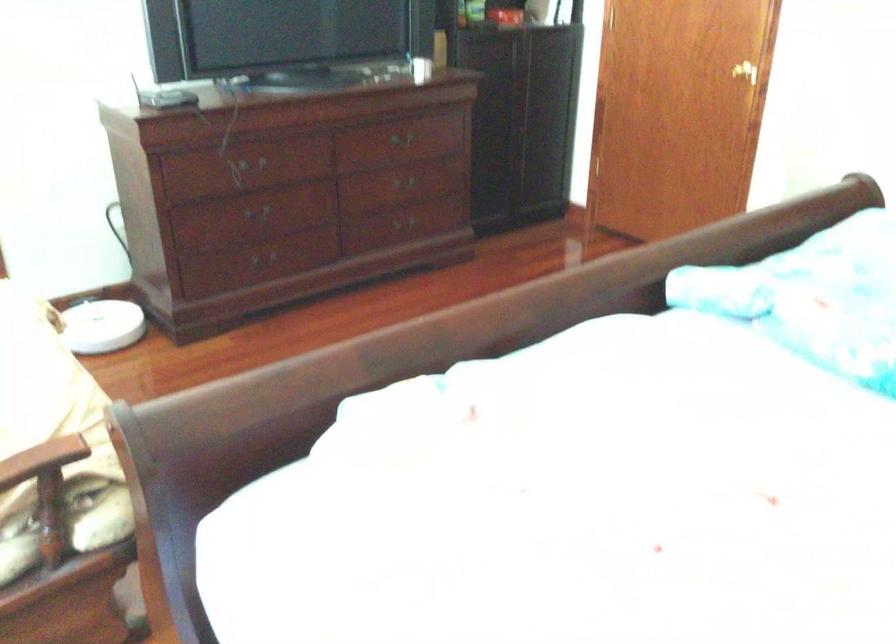
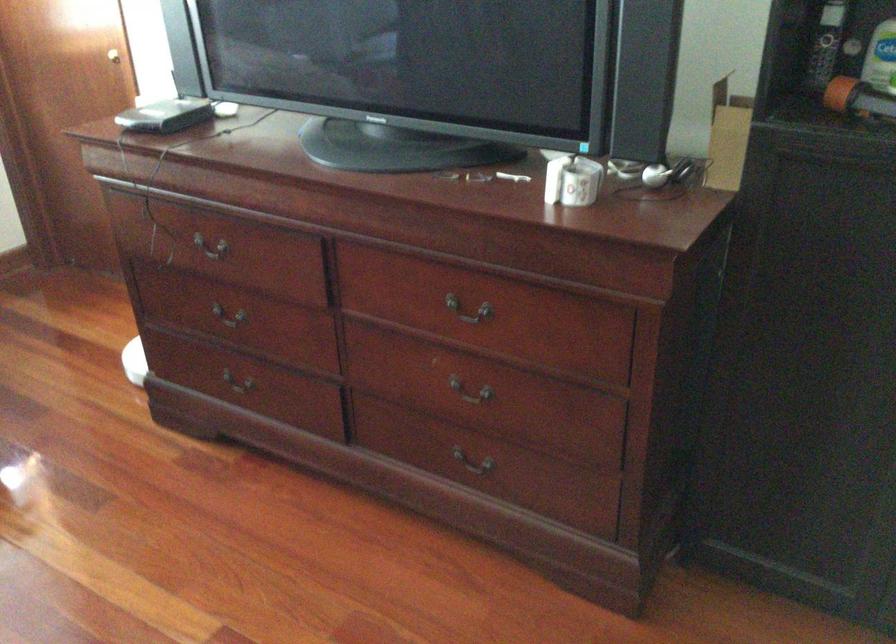
Find the pixel in the second image that matches (228,214) in the first image.

(229, 313)